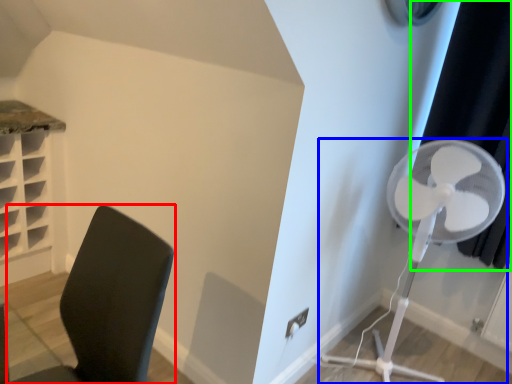
Question: Estimate the real-world distances between objects in this image. Which object is closer to furniture (highlighted by a red box), mechanical fan (highlighted by a blue box) or curtain (highlighted by a green box)?

Choices:
 (A) mechanical fan
 (B) curtain

Answer: (A)